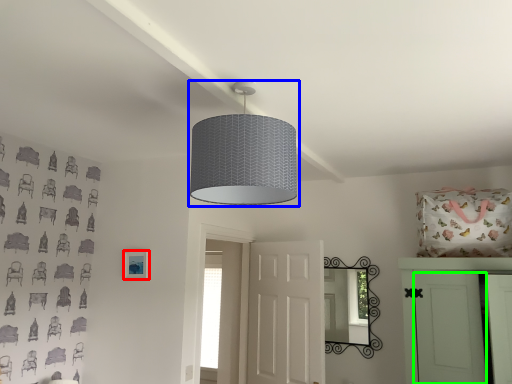
Question: Which is farther away from picture frame (highlighted by a red box)? lamp (highlighted by a blue box) or door (highlighted by a green box)?

Choices:
 (A) lamp
 (B) door

Answer: (B)